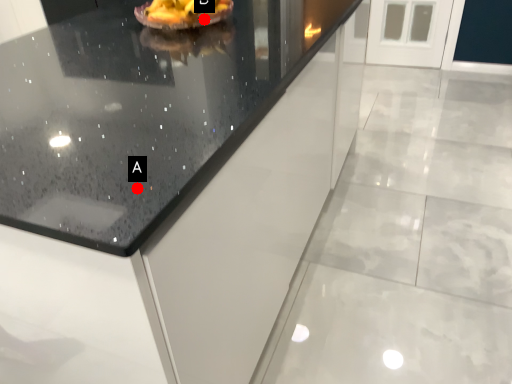
Question: Two points are circled on the image, labeled by A and B beside each circle. Which point is further to the camera?

Choices:
 (A) A is further
 (B) B is further

Answer: (B)